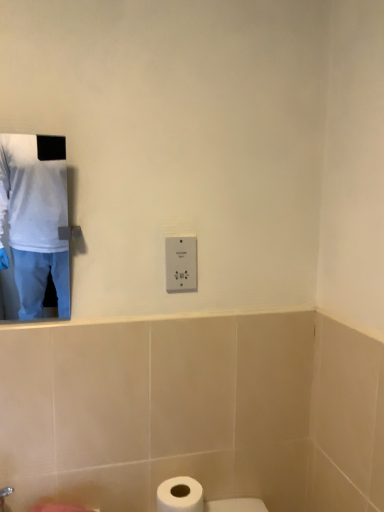
What do you see at coordinates (180, 495) in the screenshot? I see `white matte toilet paper at lower center` at bounding box center [180, 495].

Where is `white matte shirt at upper left`? white matte shirt at upper left is located at coordinates (35, 218).

Describe the element at coordinates (181, 264) in the screenshot. I see `white plastic switch at center` at that location.

Where is `white matte toilet paper at lower center`? The width and height of the screenshot is (384, 512). white matte toilet paper at lower center is located at coordinates (180, 495).

Is white matte toilet paper at lower center spatially inside white matte shirt at upper left, or outside of it?

white matte toilet paper at lower center is spatially situated outside white matte shirt at upper left.

Considering the relative sizes of white matte toilet paper at lower center and white matte shirt at upper left in the image provided, is white matte toilet paper at lower center taller than white matte shirt at upper left?

In fact, white matte toilet paper at lower center may be shorter than white matte shirt at upper left.

From the image's perspective, is white matte toilet paper at lower center located above or below white matte shirt at upper left?

Clearly, from the image's perspective, white matte toilet paper at lower center is below white matte shirt at upper left.

Visually, is white matte toilet paper at lower center positioned to the left or to the right of white matte shirt at upper left?

Based on their positions, white matte toilet paper at lower center is located to the right of white matte shirt at upper left.

Is white matte toilet paper at lower center outside of white plastic switch at center?

Yes, white matte toilet paper at lower center is not within white plastic switch at center.

At what (x,y) coordinates should I click in order to perform the action: click on toilet paper that appears on the left of white plastic switch at center. Please return your answer as a coordinate pair (x, y). The width and height of the screenshot is (384, 512). Looking at the image, I should click on (180, 495).

Can you confirm if white matte toilet paper at lower center is bigger than white plastic switch at center?

Yes.

Based on the photo, between white matte toilet paper at lower center and white plastic switch at center, which one has larger width?

With larger width is white matte toilet paper at lower center.

How distant is white matte shirt at upper left from white plastic switch at center?

white matte shirt at upper left and white plastic switch at center are 4.53 feet apart.

Locate an element on the screen. The image size is (384, 512). electric outlet below the white matte shirt at upper left (from a real-world perspective) is located at coordinates (181, 264).

Which object is thinner, white matte shirt at upper left or white plastic switch at center?

white plastic switch at center.

In the scene shown: Is white matte shirt at upper left bigger or smaller than white plastic switch at center?

Clearly, white matte shirt at upper left is larger in size than white plastic switch at center.

Between white plastic switch at center and white matte toilet paper at lower center, which one has smaller size?

With smaller size is white plastic switch at center.

From a real-world perspective, who is located higher, white plastic switch at center or white matte toilet paper at lower center?

white plastic switch at center.

How many degrees apart are the facing directions of white plastic switch at center and white matte toilet paper at lower center?

1.6 degrees.

Between white plastic switch at center and white matte toilet paper at lower center, which one is positioned behind?

white plastic switch at center is further away from the camera.

Is white matte shirt at upper left wider or thinner than white matte toilet paper at lower center?

Considering their sizes, white matte shirt at upper left looks slimmer than white matte toilet paper at lower center.

Looking at this image, looking at the image, does white matte shirt at upper left seem bigger or smaller compared to white matte toilet paper at lower center?

white matte shirt at upper left is bigger than white matte toilet paper at lower center.

Does point (54, 284) come in front of point (158, 510)?

No, (54, 284) is further to viewer.

Would you say white matte toilet paper at lower center is part of white matte shirt at upper left's contents?

No, white matte shirt at upper left does not contain white matte toilet paper at lower center.

Does white plastic switch at center have a greater height compared to white matte shirt at upper left?

Incorrect, the height of white plastic switch at center is not larger of that of white matte shirt at upper left.

Could you tell me if white plastic switch at center is facing white matte shirt at upper left?

No, white plastic switch at center is not aimed at white matte shirt at upper left.

In the scene shown: Can you confirm if white plastic switch at center is positioned to the right of white matte shirt at upper left?

Yes.

Is there a large distance between white plastic switch at center and white matte shirt at upper left?

Absolutely, white plastic switch at center is distant from white matte shirt at upper left.

Find the location of a particular element. Image resolution: width=384 pixels, height=512 pixels. man above the white matte toilet paper at lower center (from the image's perspective) is located at coordinates (35, 218).

At what (x,y) coordinates should I click in order to perform the action: click on toilet paper that is on the left side of white plastic switch at center. Please return your answer as a coordinate pair (x, y). Image resolution: width=384 pixels, height=512 pixels. Looking at the image, I should click on (180, 495).

When comparing their distances from white matte toilet paper at lower center, does white matte shirt at upper left or white plastic switch at center seem further?

white matte shirt at upper left lies further to white matte toilet paper at lower center than the other object.

Based on their spatial positions, is white plastic switch at center or white matte shirt at upper left further from white matte toilet paper at lower center?

white matte shirt at upper left lies further to white matte toilet paper at lower center than the other object.

When comparing their distances from white matte shirt at upper left, does white plastic switch at center or white matte toilet paper at lower center seem further?

Based on the image, white matte toilet paper at lower center appears to be further to white matte shirt at upper left.

Considering their positions, is white matte toilet paper at lower center positioned further to white matte shirt at upper left than white plastic switch at center?

white matte toilet paper at lower center is further to white matte shirt at upper left.

Which object lies nearer to the anchor point white plastic switch at center, white matte toilet paper at lower center or white matte shirt at upper left?

white matte toilet paper at lower center.

Considering their positions, is white matte shirt at upper left positioned further to white plastic switch at center than white matte toilet paper at lower center?

Among the two, white matte shirt at upper left is located further to white plastic switch at center.

In order to click on electric outlet between white matte shirt at upper left and white matte toilet paper at lower center from top to bottom in this screenshot , I will do `click(181, 264)`.